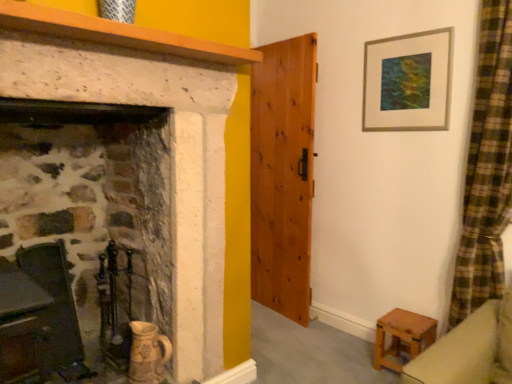
Question: Considering the positions of smooth wooden mantle at upper left and wooden chair at left in the image, is smooth wooden mantle at upper left wider or thinner than wooden chair at left?

Choices:
 (A) wide
 (B) thin

Answer: (A)

Question: Considering the positions of smooth wooden mantle at upper left and wooden chair at left in the image, is smooth wooden mantle at upper left bigger or smaller than wooden chair at left?

Choices:
 (A) big
 (B) small

Answer: (B)

Question: Estimate the real-world distances between objects in this image. Which object is closer to the wooden stool at lower right?

Choices:
 (A) smooth wooden mantle at upper left
 (B) metallic silver picture frame at upper right
 (C) wooden chair at left
 (D) natural wood door at center

Answer: (D)

Question: Based on their relative distances, which object is nearer to the wooden chair at left?

Choices:
 (A) smooth wooden mantle at upper left
 (B) metallic silver picture frame at upper right
 (C) natural wood door at center
 (D) wooden stool at lower right

Answer: (A)